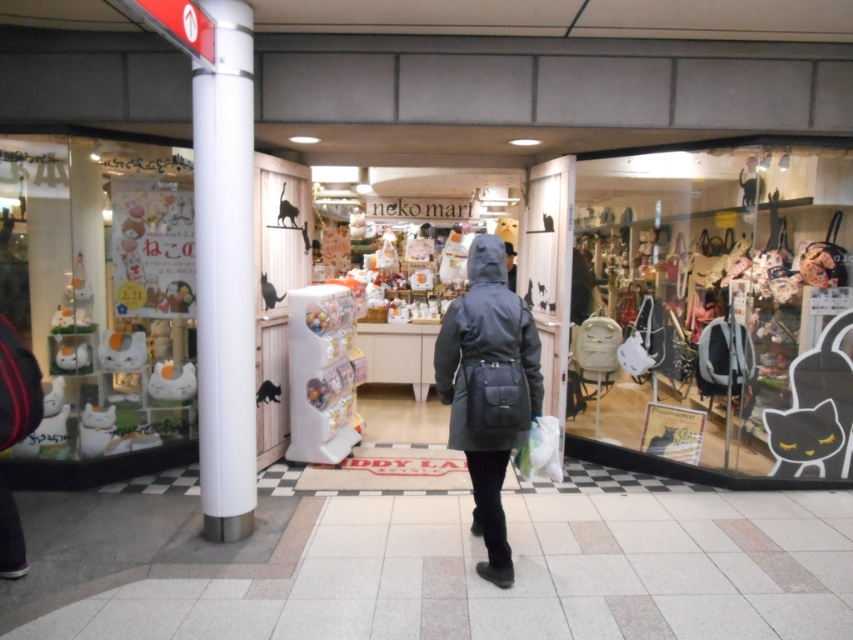
Can you confirm if white smooth pole at left is bigger than dark gray hooded coat at center?

Actually, white smooth pole at left might be smaller than dark gray hooded coat at center.

You are a GUI agent. You are given a task and a screenshot of the screen. Output one action in this format:
    pyautogui.click(x=<x>, y=<y>)
    Task: Click on the white smooth pole at left
    Image resolution: width=853 pixels, height=640 pixels.
    Given the screenshot: What is the action you would take?
    pyautogui.click(x=225, y=272)

Where is `white smooth pole at left`? The width and height of the screenshot is (853, 640). white smooth pole at left is located at coordinates (225, 272).